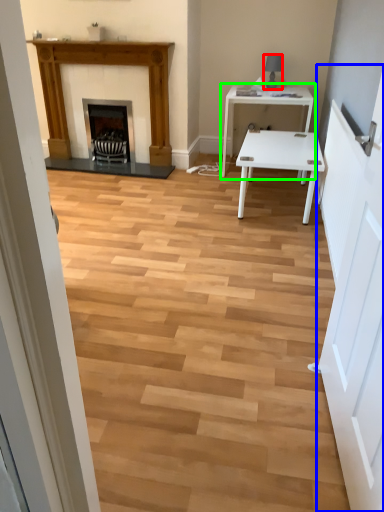
Question: Which is farther away from lamp (highlighted by a red box)? door (highlighted by a blue box) or table (highlighted by a green box)?

Choices:
 (A) door
 (B) table

Answer: (A)